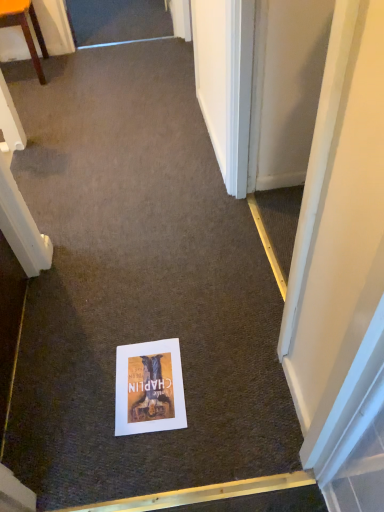
Find the location of a particular element. vacant space underneath matte paper poster at center (from a real-world perspective) is located at coordinates (148, 387).